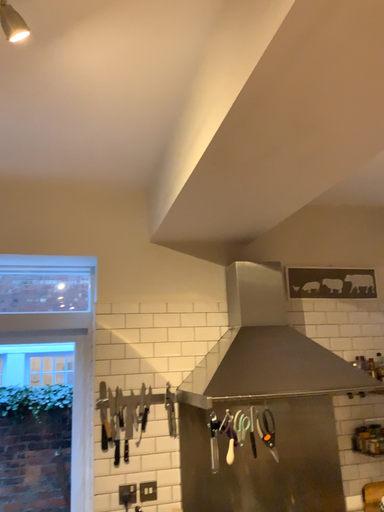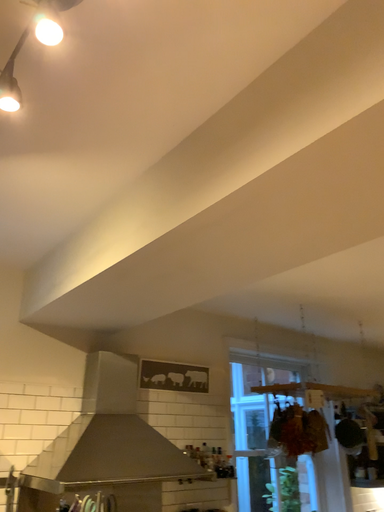
Question: Which way did the camera rotate in the video?

Choices:
 (A) rotated right
 (B) rotated left

Answer: (A)